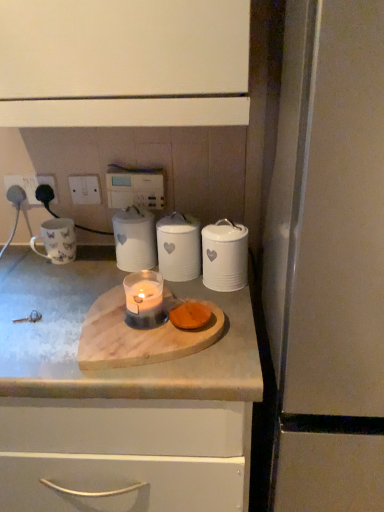
Locate an element on the screen. The image size is (384, 512). vacant area that is in front of white ceramic canister at right, the 3th kitchen appliance when ordered from left to right is located at coordinates (231, 314).